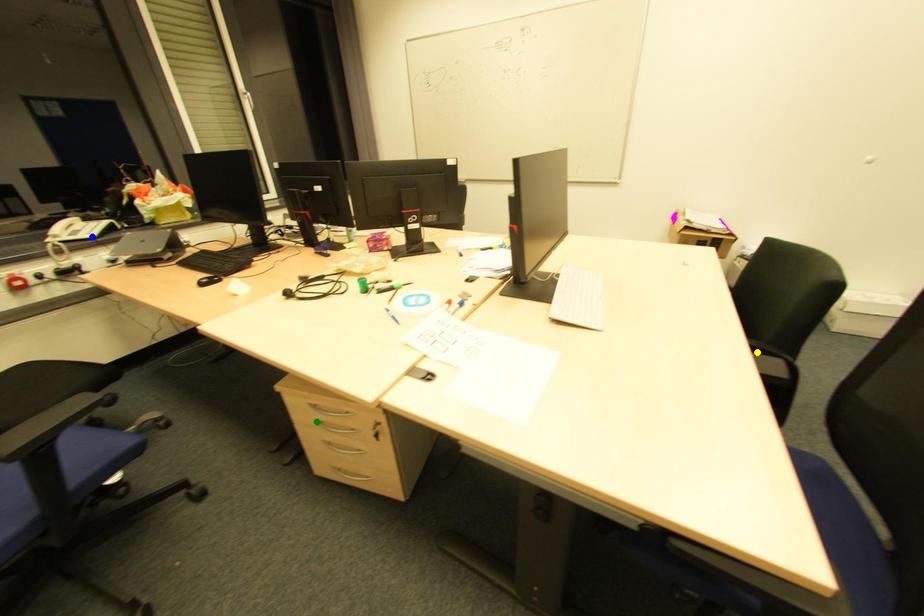
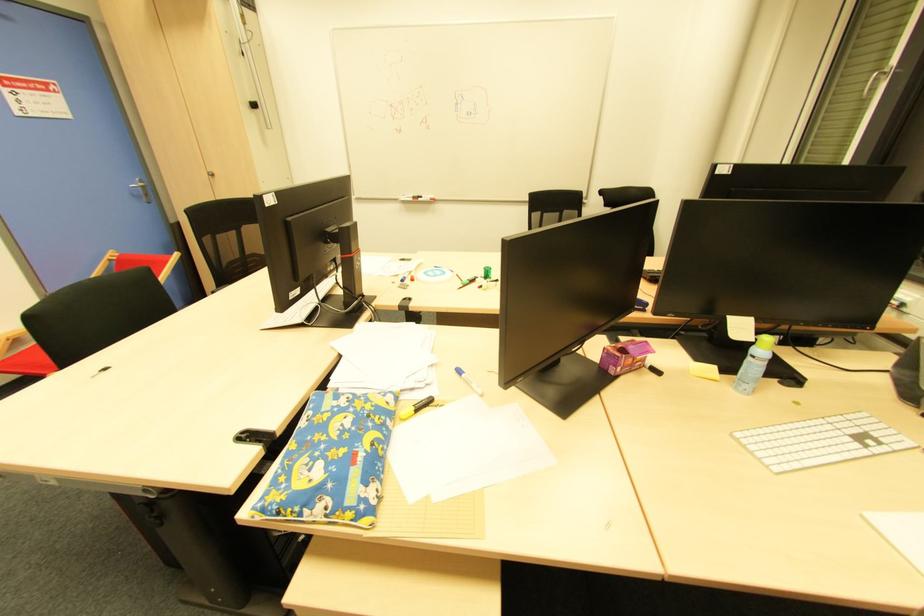
I am providing you with two images of the same scene from different viewpoints. Three points are marked in image1. Which point corresponds to a part or object that is occluded in image2?In image1, three points are marked. Which of them correspond to a part or object that is occluded in image2?Among the three points shown in image1, which one corresponds to a part or object that is no longer visible due to occlusion in image2?

Invisible in image2: yellow point, green point, blue point.